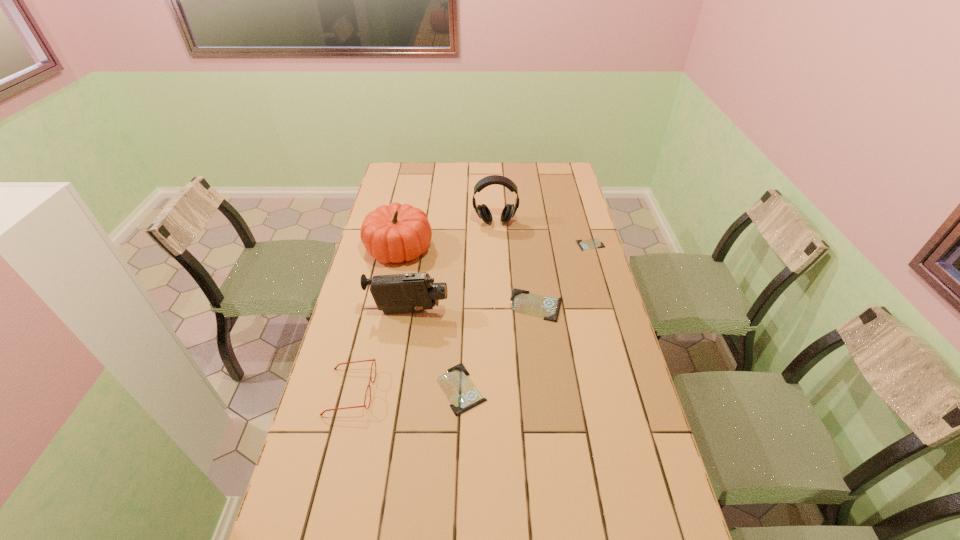
This screenshot has width=960, height=540. Identify the location of vacant space that is in between the pumpkin and the second identity card from right to left. (468, 277).

This screenshot has height=540, width=960. I want to click on vacant area between the pumpkin and the second farthest identity card, so pyautogui.click(x=468, y=277).

Where is `free spot between the second shortest identity card and the second nearest identity card`? The width and height of the screenshot is (960, 540). free spot between the second shortest identity card and the second nearest identity card is located at coordinates (499, 347).

I want to click on empty location between the second shortest identity card and the fourth tallest object, so click(406, 390).

Find the location of `free space between the leftmost identity card and the spectacles`. free space between the leftmost identity card and the spectacles is located at coordinates (406, 390).

Select which object appears as the sixth closest to the spectacles. Please provide its 2D coordinates. Your answer should be formatted as a tuple, i.e. [(x, y)], where the tuple contains the x and y coordinates of a point satisfying the conditions above.

[(592, 243)]

Image resolution: width=960 pixels, height=540 pixels. Identify the location of object that stands as the fourth closest to the second farthest identity card. (394, 233).

The height and width of the screenshot is (540, 960). What are the coordinates of `identity card identified as the closest to the camcorder` in the screenshot? It's located at (461, 392).

Find the location of `identity card that is the closest to the second tallest identity card`. identity card that is the closest to the second tallest identity card is located at coordinates (523, 302).

The width and height of the screenshot is (960, 540). In order to click on vacant area in the image that satisfies the following two spatial constraints: 1. on the front side of the pumpkin; 2. on the right side of the second identity card from right to left in this screenshot , I will do point(387,305).